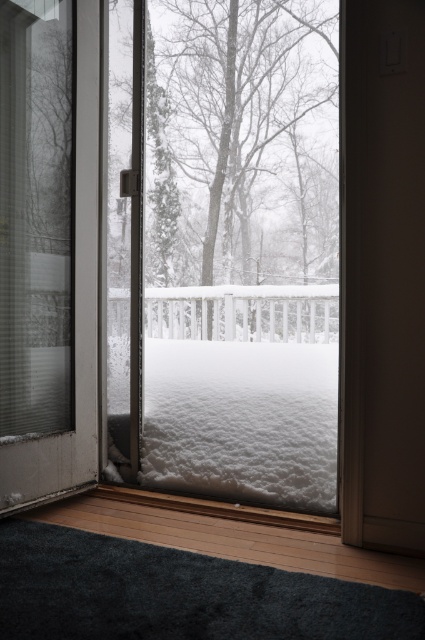
Does brown matte door at center have a greater height compared to white fluffy snow at center?

Yes.

Can you confirm if brown matte door at center is positioned to the left of white fluffy snow at center?

Incorrect, brown matte door at center is not on the left side of white fluffy snow at center.

Who is more distant from viewer, (x=404, y=80) or (x=302, y=365)?

Positioned behind is point (x=302, y=365).

I want to click on brown matte door at center, so click(x=382, y=275).

Which of these two, white fluffy snow at center or white wooden rail at center, stands taller?

white fluffy snow at center

From the picture: Is white fluffy snow at center to the left of white wooden rail at center from the viewer's perspective?

Indeed, white fluffy snow at center is positioned on the left side of white wooden rail at center.

Measure the distance between point (x=184, y=458) and camera.

Point (x=184, y=458) and camera are 8.60 feet apart.

This screenshot has width=425, height=640. Find the location of `white fluffy snow at center`. white fluffy snow at center is located at coordinates (241, 420).

Is transparent glass window at center above white wooden rail at center?

Indeed, transparent glass window at center is positioned over white wooden rail at center.

Can you confirm if transparent glass window at center is bigger than white wooden rail at center?

Incorrect, transparent glass window at center is not larger than white wooden rail at center.

Where is `transparent glass window at center`? This screenshot has width=425, height=640. transparent glass window at center is located at coordinates click(226, 253).